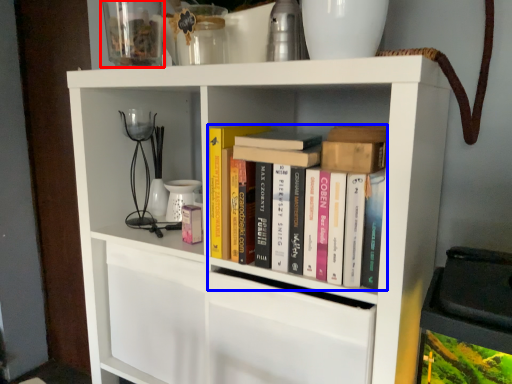
Question: Which of the following is the farthest to the observer, glass vase (highlighted by a red box) or book (highlighted by a blue box)?

Choices:
 (A) glass vase
 (B) book

Answer: (A)